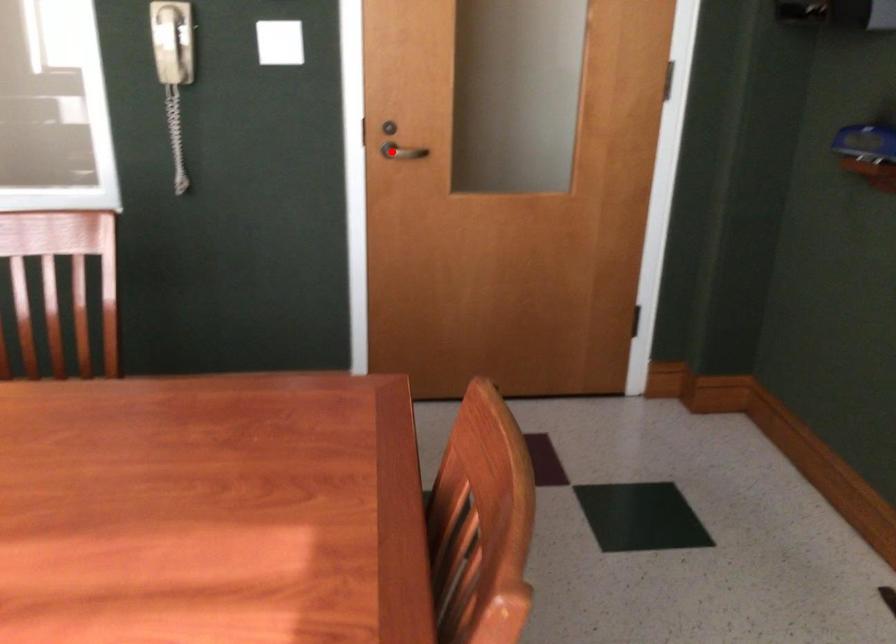
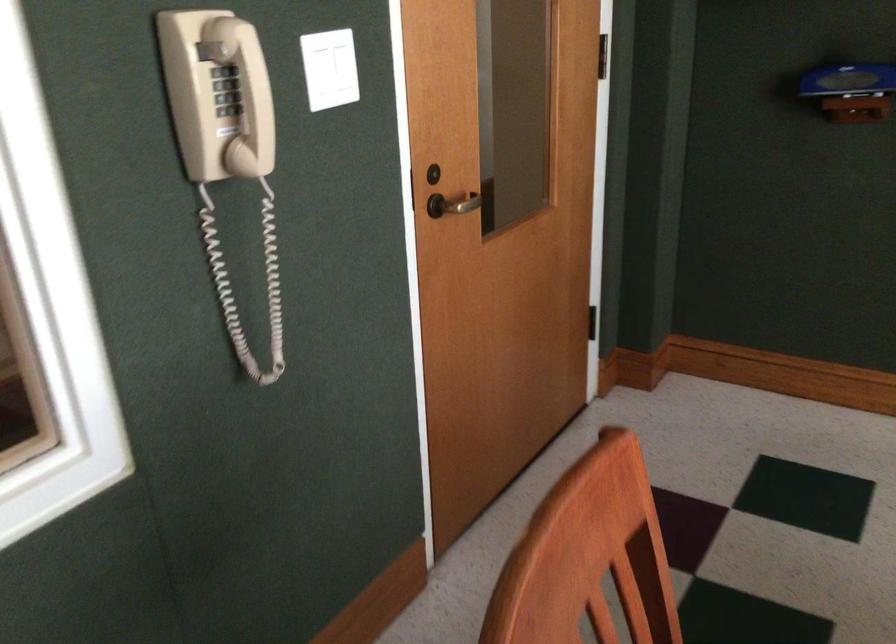
The point at the highlighted location is marked in the first image. Where is the corresponding point in the second image?

(458, 204)